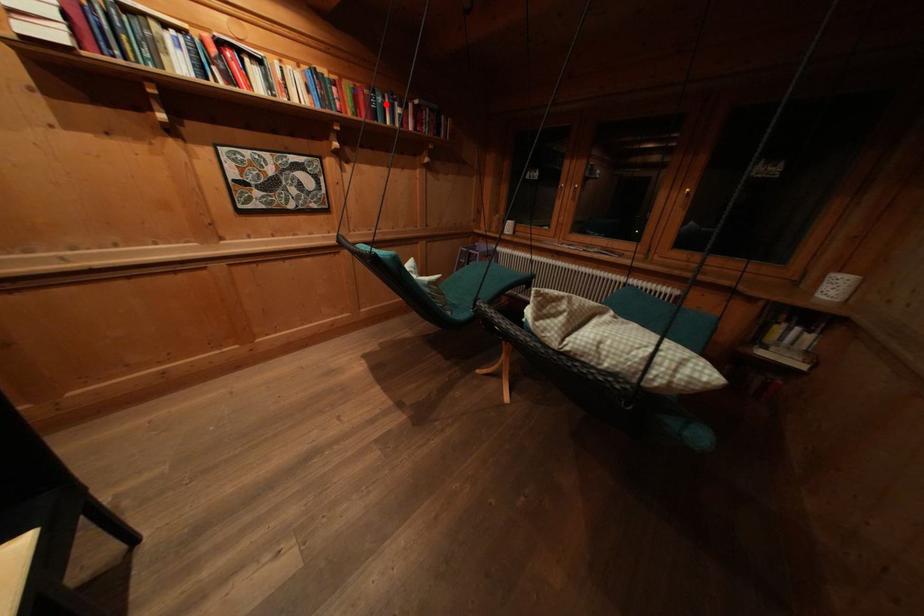
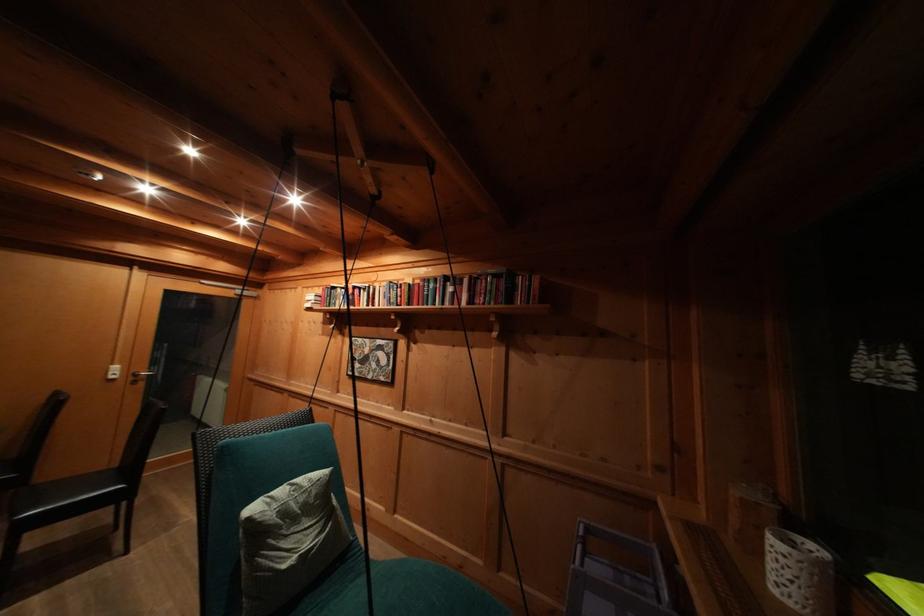
Question: I am providing you with two images of the same scene from different viewpoints. A red point is marked on the first image. Is the red point's position out of view in image 2?

Choices:
 (A) Yes
 (B) No

Answer: (B)